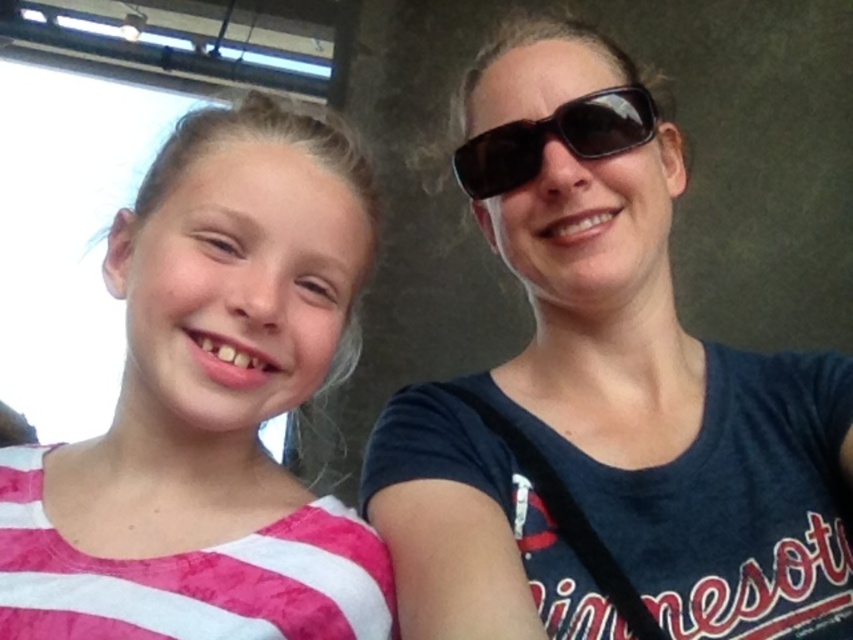
Question: Which of these objects is positioned farthest from the pink striped shirt at left?

Choices:
 (A) black matte sunglasses at upper center
 (B) matte black sunglasses at upper center

Answer: (A)

Question: Can you confirm if matte black sunglasses at upper center is smaller than black matte sunglasses at upper center?

Choices:
 (A) no
 (B) yes

Answer: (A)

Question: Which object is farther from the camera taking this photo?

Choices:
 (A) black matte sunglasses at upper center
 (B) pink striped shirt at left

Answer: (A)

Question: In this image, where is matte black sunglasses at upper center located relative to pink striped shirt at left?

Choices:
 (A) below
 (B) above

Answer: (B)

Question: Does pink striped shirt at left appear on the left side of black matte sunglasses at upper center?

Choices:
 (A) yes
 (B) no

Answer: (A)

Question: Which point is farther to the camera?

Choices:
 (A) black matte sunglasses at upper center
 (B) pink striped shirt at left
 (C) matte black sunglasses at upper center

Answer: (A)